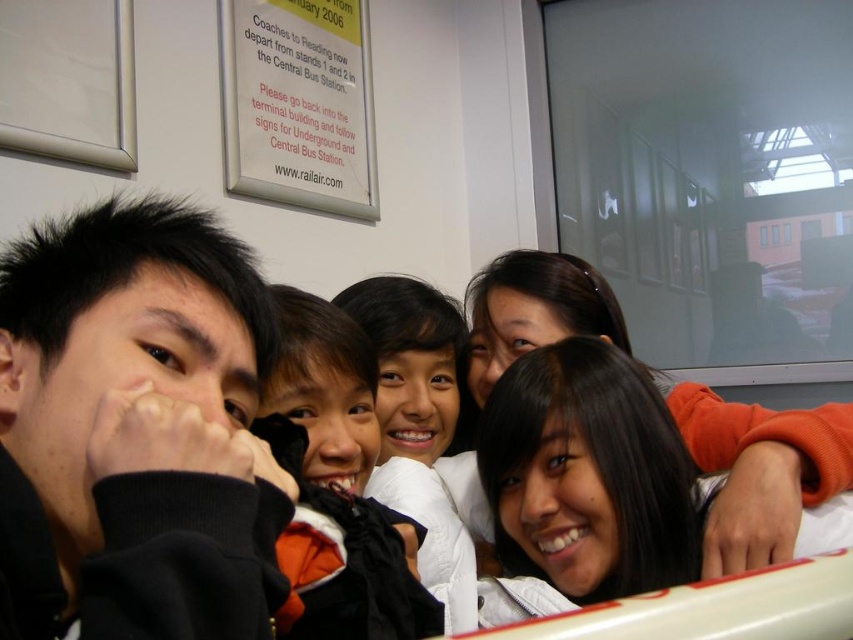
You are standing at the entrance of the train station and see the orange fleece jacket at center and the white paper sign at upper center. Which object is closer to you?

The orange fleece jacket at center is closer to you since it is only 4.22 feet away from the white paper sign at upper center, implying that the jacket is nearer to your position.